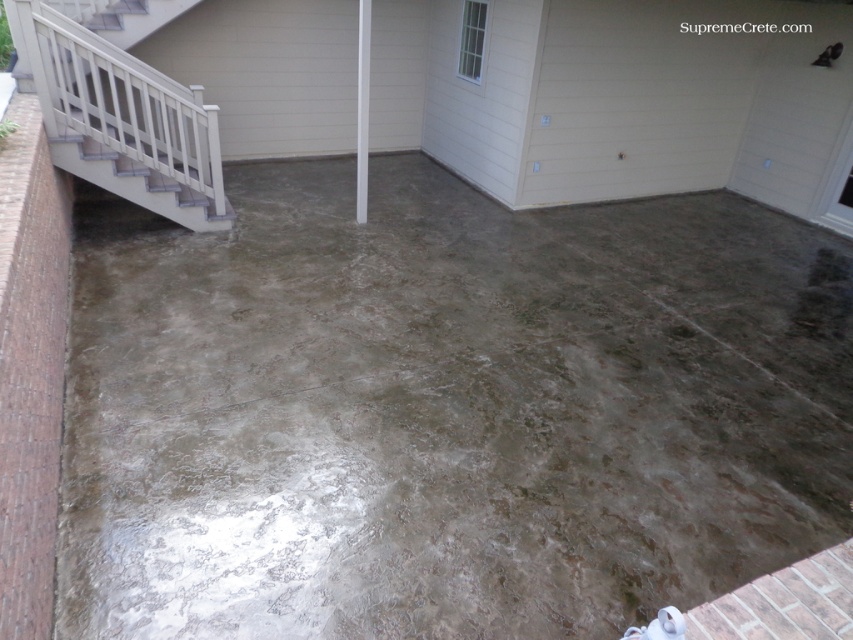
You are standing at the entrance of the residential outdoor area and want to reach the brick wall bordering the patio. Based on the image, which direction should you move from the white painted wood stairs at upper left to reach the brick wall?

The white painted wood stairs at upper left are located at point (123, 118). Since the brick wall borders the patio, you should move downward from the white painted wood stairs at upper left to reach the brick wall.

You are standing at the point marked as point (444,410). Which object is directly under your feet?

The textured concrete at center is located at point (444,410), so the object directly under your feet is the textured concrete at center.

You are a painter who needs to paint both the white painted wood stairs at upper left and the white smooth pole at center. Which object requires a taller ladder to reach its top?

The white painted wood stairs at upper left is taller than the white smooth pole at center, so you will need a taller ladder to paint the white painted wood stairs at upper left.